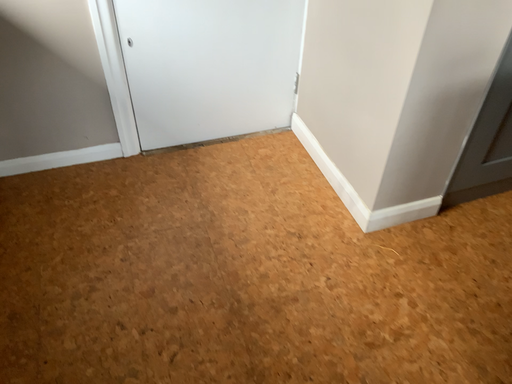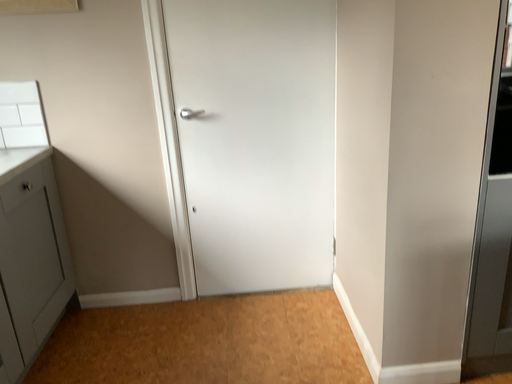
Question: Which way did the camera rotate in the video?

Choices:
 (A) rotated left
 (B) rotated right

Answer: (A)